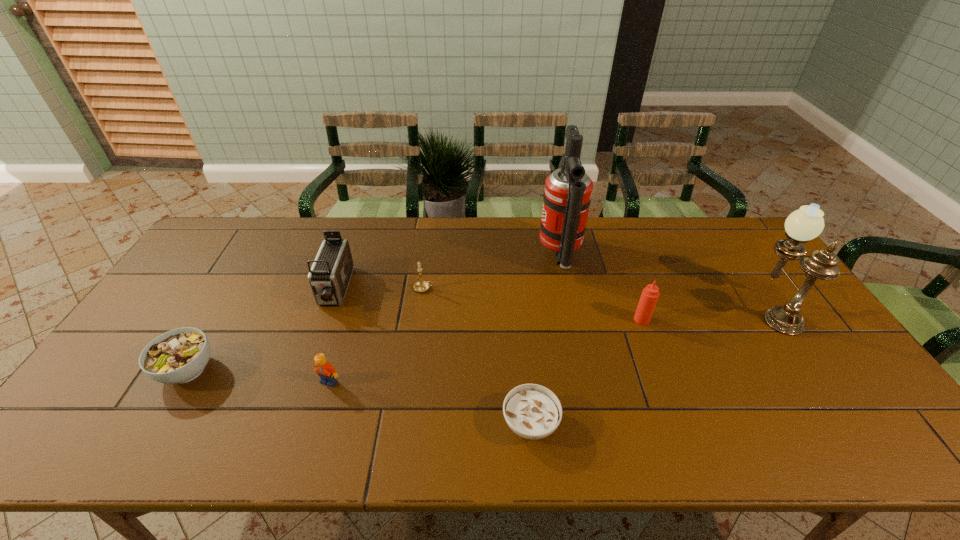
The image size is (960, 540). I want to click on vacant space situated on the right of the second shortest object, so click(x=235, y=370).

I want to click on free space located 0.310m on the left of the right soup bowl, so click(x=369, y=423).

Identify the location of object that is positioned at the far edge. (567, 196).

The height and width of the screenshot is (540, 960). I want to click on object that is at the near edge, so click(532, 411).

This screenshot has width=960, height=540. I want to click on object present at the left edge, so click(x=180, y=355).

Identify the location of object that is at the right edge. (805, 224).

In order to click on free space at the far edge of the desktop in this screenshot , I will do tap(699, 244).

The height and width of the screenshot is (540, 960). In order to click on vacant space at the left edge of the desktop in this screenshot , I will do `click(126, 346)`.

Image resolution: width=960 pixels, height=540 pixels. What are the coordinates of `vacant space at the right edge` in the screenshot? It's located at (804, 342).

Image resolution: width=960 pixels, height=540 pixels. What are the coordinates of `free space at the far left corner` in the screenshot? It's located at (235, 225).